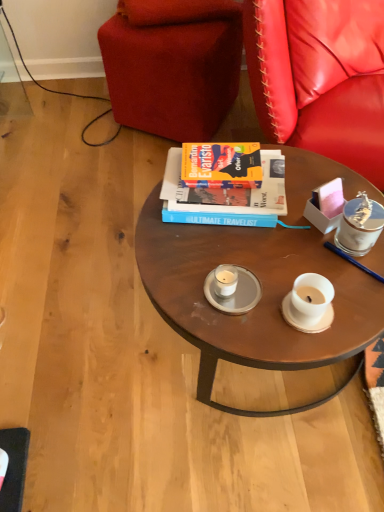
Locate an element on the screen. This screenshot has height=512, width=384. free space to the right of hardcover book at center is located at coordinates (307, 195).